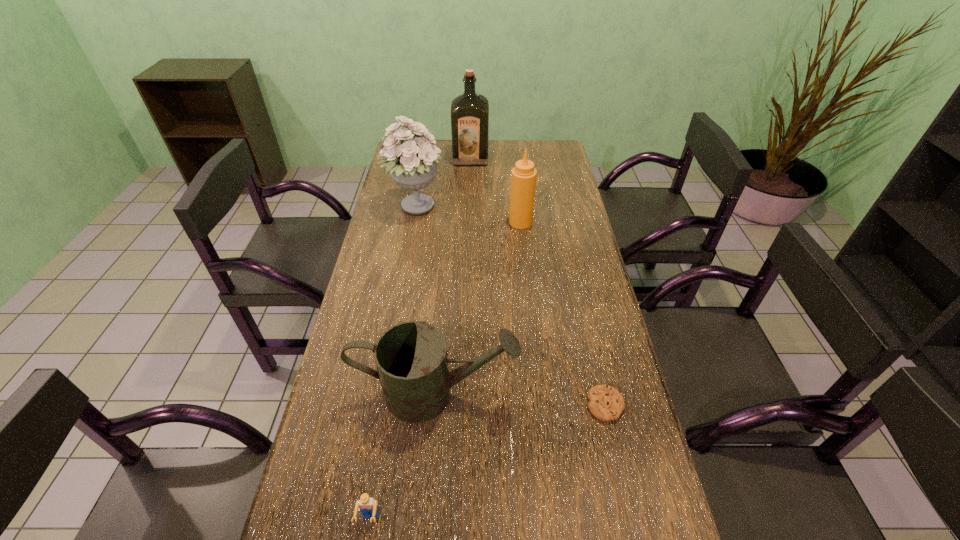
In order to click on vacant space located 0.270m on the right of the bouquet in this screenshot , I will do `click(517, 208)`.

Where is `vacant space located on the left of the second object from right to left`? The width and height of the screenshot is (960, 540). vacant space located on the left of the second object from right to left is located at coordinates coord(469,222).

The height and width of the screenshot is (540, 960). In order to click on vacant point located 0.150m with the spout on the third shortest object in this screenshot , I will do `click(578, 393)`.

Locate an element on the screen. This screenshot has height=540, width=960. vacant space situated on the left of the rightmost object is located at coordinates (562, 405).

Locate an element on the screen. object positioned at the far edge is located at coordinates (469, 111).

This screenshot has height=540, width=960. Identify the location of bouquet that is at the left edge. (412, 164).

Identify the location of watering can at the left edge. This screenshot has height=540, width=960. (411, 358).

This screenshot has height=540, width=960. What are the coordinates of `Lego positioned at the left edge` in the screenshot? It's located at (367, 505).

You are a GUI agent. You are given a task and a screenshot of the screen. Output one action in this format:
    pyautogui.click(x=<x>, y=<y>)
    Task: Click on the object that is at the right edge
    
    Given the screenshot: What is the action you would take?
    pyautogui.click(x=606, y=403)

This screenshot has width=960, height=540. I want to click on free region at the far edge of the desktop, so click(x=513, y=166).